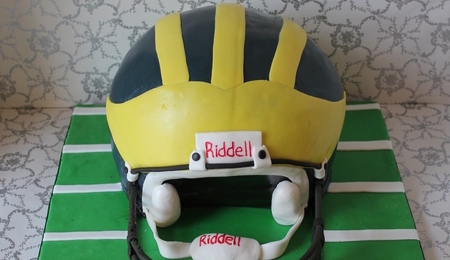
Find the location of a particular element. screws is located at coordinates (196, 158), (262, 153).